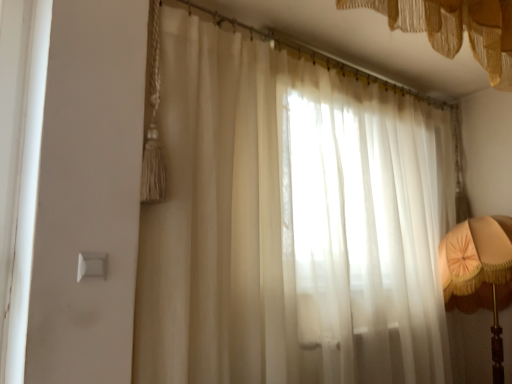
What is the approximate width of white plastic light switch at lower left?

It is 0.58 inches.

This screenshot has width=512, height=384. Describe the element at coordinates (479, 272) in the screenshot. I see `matte orange fabric lampshade at right` at that location.

Measure the distance between translucent fabric curtain at upper center, the 1th curtain positioned from the top, and camera.

The distance of translucent fabric curtain at upper center, the 1th curtain positioned from the top, from camera is 3.96 feet.

Find the location of a particular element. This screenshot has width=512, height=384. white plastic light switch at lower left is located at coordinates (91, 265).

Between sheer white curtain at center, which appears as the 2th curtain when viewed from the top, and matte orange fabric lampshade at right, which one has smaller width?

Thinner between the two is sheer white curtain at center, which appears as the 2th curtain when viewed from the top.

Identify the location of bedside lamp lying on the right of sheer white curtain at center, the 1th curtain from the bottom. (479, 272).

Considering the positions of objects sheer white curtain at center, the 1th curtain from the bottom, and matte orange fabric lampshade at right in the image provided, who is more to the right, sheer white curtain at center, the 1th curtain from the bottom, or matte orange fabric lampshade at right?

matte orange fabric lampshade at right is more to the right.

Is translucent fabric curtain at upper center, the 1th curtain positioned from the top, to the right of sheer white curtain at center, which appears as the 2th curtain when viewed from the top, from the viewer's perspective?

Indeed, translucent fabric curtain at upper center, the 1th curtain positioned from the top, is positioned on the right side of sheer white curtain at center, which appears as the 2th curtain when viewed from the top.

In terms of height, does translucent fabric curtain at upper center, which is the 2th curtain from bottom to top, look taller or shorter compared to sheer white curtain at center, which appears as the 2th curtain when viewed from the top?

Considering their sizes, translucent fabric curtain at upper center, which is the 2th curtain from bottom to top, has less height than sheer white curtain at center, which appears as the 2th curtain when viewed from the top.

Is translucent fabric curtain at upper center, which is the 2th curtain from bottom to top, wider or thinner than sheer white curtain at center, which appears as the 2th curtain when viewed from the top?

In the image, translucent fabric curtain at upper center, which is the 2th curtain from bottom to top, appears to be more narrow than sheer white curtain at center, which appears as the 2th curtain when viewed from the top.

Considering the relative positions of sheer white curtain at center, the 1th curtain from the bottom, and translucent fabric curtain at upper center, which is the 2th curtain from bottom to top, in the image provided, is sheer white curtain at center, the 1th curtain from the bottom, to the left of translucent fabric curtain at upper center, which is the 2th curtain from bottom to top, from the viewer's perspective?

Yes.

From the picture: Considering the relative positions of sheer white curtain at center, which appears as the 2th curtain when viewed from the top, and translucent fabric curtain at upper center, the 1th curtain positioned from the top, in the image provided, is sheer white curtain at center, which appears as the 2th curtain when viewed from the top, in front of translucent fabric curtain at upper center, the 1th curtain positioned from the top,?

No, sheer white curtain at center, which appears as the 2th curtain when viewed from the top, is further to the viewer.

From a real-world perspective, is sheer white curtain at center, which appears as the 2th curtain when viewed from the top, on top of translucent fabric curtain at upper center, which is the 2th curtain from bottom to top?

No, from a real-world perspective, sheer white curtain at center, which appears as the 2th curtain when viewed from the top, is not above translucent fabric curtain at upper center, which is the 2th curtain from bottom to top.

From the picture: Is sheer white curtain at center, the 1th curtain from the bottom, oriented away from white plastic light switch at lower left?

No, sheer white curtain at center, the 1th curtain from the bottom, is not facing the opposite direction of white plastic light switch at lower left.

Is sheer white curtain at center, the 1th curtain from the bottom, far from white plastic light switch at lower left?

Actually, sheer white curtain at center, the 1th curtain from the bottom, and white plastic light switch at lower left are a little close together.

Measure the distance from sheer white curtain at center, which appears as the 2th curtain when viewed from the top, to white plastic light switch at lower left.

sheer white curtain at center, which appears as the 2th curtain when viewed from the top, is 35.49 inches from white plastic light switch at lower left.

Does sheer white curtain at center, the 1th curtain from the bottom, have a lesser width compared to white plastic light switch at lower left?

In fact, sheer white curtain at center, the 1th curtain from the bottom, might be wider than white plastic light switch at lower left.

Which is further, (x=488, y=257) or (x=91, y=261)?

The point (x=488, y=257) is behind.

Does matte orange fabric lampshade at right have a smaller size compared to white plastic light switch at lower left?

Actually, matte orange fabric lampshade at right might be larger than white plastic light switch at lower left.

Is white plastic light switch at lower left inside matte orange fabric lampshade at right?

Actually, white plastic light switch at lower left is outside matte orange fabric lampshade at right.

Does matte orange fabric lampshade at right have a greater width compared to white plastic light switch at lower left?

Yes, matte orange fabric lampshade at right is wider than white plastic light switch at lower left.

Which is behind, point (466, 233) or point (464, 10)?

Point (466, 233)

Is matte orange fabric lampshade at right aimed at translucent fabric curtain at upper center, which is the 2th curtain from bottom to top?

No, matte orange fabric lampshade at right is not facing towards translucent fabric curtain at upper center, which is the 2th curtain from bottom to top.

Where is `bedside lamp on the right of translucent fabric curtain at upper center, the 1th curtain positioned from the top`? This screenshot has width=512, height=384. bedside lamp on the right of translucent fabric curtain at upper center, the 1th curtain positioned from the top is located at coordinates (479, 272).

Are matte orange fabric lampshade at right and translucent fabric curtain at upper center, the 1th curtain positioned from the top, located far from each other?

Yes.

Does point (443, 270) come closer to viewer compared to point (211, 177)?

No.

Does matte orange fabric lampshade at right have a greater width compared to sheer white curtain at center, the 1th curtain from the bottom?

Yes.

Can you confirm if matte orange fabric lampshade at right is positioned to the left of sheer white curtain at center, the 1th curtain from the bottom?

No.

Identify the location of curtain that is the 1st object above the matte orange fabric lampshade at right (from a real-world perspective). (289, 224).

Find the location of a particular element. The height and width of the screenshot is (384, 512). curtain to the right of sheer white curtain at center, which appears as the 2th curtain when viewed from the top is located at coordinates (455, 28).

Considering their positions, is white plastic light switch at lower left positioned closer to sheer white curtain at center, the 1th curtain from the bottom, than translucent fabric curtain at upper center, the 1th curtain positioned from the top?

Among the two, translucent fabric curtain at upper center, the 1th curtain positioned from the top, is located nearer to sheer white curtain at center, the 1th curtain from the bottom.

Looking at the image, which one is located closer to sheer white curtain at center, which appears as the 2th curtain when viewed from the top, white plastic light switch at lower left or matte orange fabric lampshade at right?

matte orange fabric lampshade at right is closer to sheer white curtain at center, which appears as the 2th curtain when viewed from the top.

When comparing their distances from sheer white curtain at center, which appears as the 2th curtain when viewed from the top, does translucent fabric curtain at upper center, the 1th curtain positioned from the top, or white plastic light switch at lower left seem closer?

translucent fabric curtain at upper center, the 1th curtain positioned from the top, lies closer to sheer white curtain at center, which appears as the 2th curtain when viewed from the top, than the other object.

Based on the photo, from the image, which object appears to be farther from matte orange fabric lampshade at right, sheer white curtain at center, which appears as the 2th curtain when viewed from the top, or translucent fabric curtain at upper center, the 1th curtain positioned from the top?

Among the two, translucent fabric curtain at upper center, the 1th curtain positioned from the top, is located further to matte orange fabric lampshade at right.

Considering their positions, is matte orange fabric lampshade at right positioned closer to translucent fabric curtain at upper center, which is the 2th curtain from bottom to top, than white plastic light switch at lower left?

matte orange fabric lampshade at right is positioned closer to the anchor translucent fabric curtain at upper center, which is the 2th curtain from bottom to top.

Which object lies further to the anchor point translucent fabric curtain at upper center, which is the 2th curtain from bottom to top, sheer white curtain at center, which appears as the 2th curtain when viewed from the top, or white plastic light switch at lower left?

Among the two, white plastic light switch at lower left is located further to translucent fabric curtain at upper center, which is the 2th curtain from bottom to top.

When comparing their distances from matte orange fabric lampshade at right, does white plastic light switch at lower left or sheer white curtain at center, which appears as the 2th curtain when viewed from the top, seem closer?

sheer white curtain at center, which appears as the 2th curtain when viewed from the top, is closer to matte orange fabric lampshade at right.

From the image, which object appears to be farther from matte orange fabric lampshade at right, sheer white curtain at center, which appears as the 2th curtain when viewed from the top, or white plastic light switch at lower left?

white plastic light switch at lower left lies further to matte orange fabric lampshade at right than the other object.

Find the location of a particular element. The image size is (512, 384). curtain situated between white plastic light switch at lower left and translucent fabric curtain at upper center, the 1th curtain positioned from the top, from left to right is located at coordinates (289, 224).

At what (x,y) coordinates should I click in order to perform the action: click on curtain between translucent fabric curtain at upper center, which is the 2th curtain from bottom to top, and matte orange fabric lampshade at right in the up-down direction. Please return your answer as a coordinate pair (x, y). Looking at the image, I should click on (x=289, y=224).